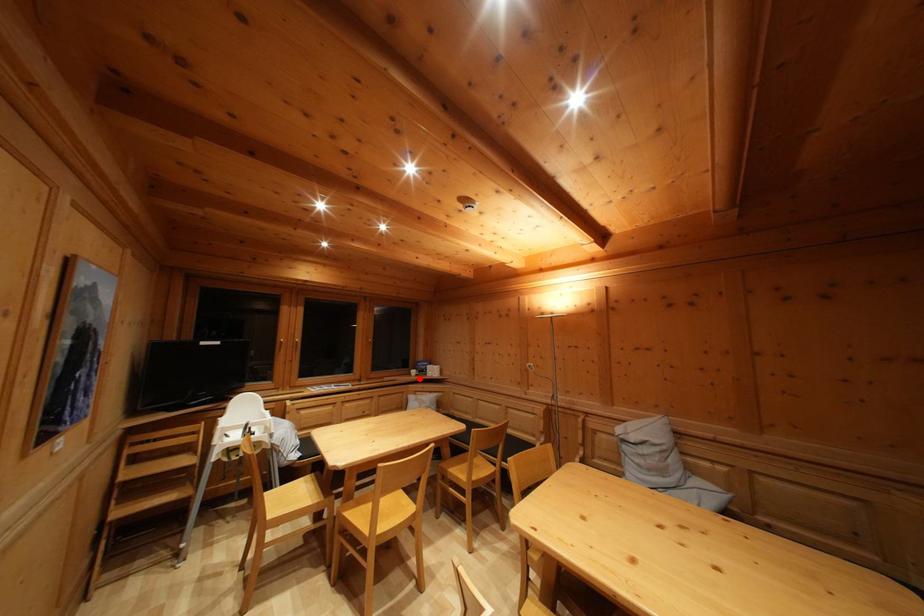
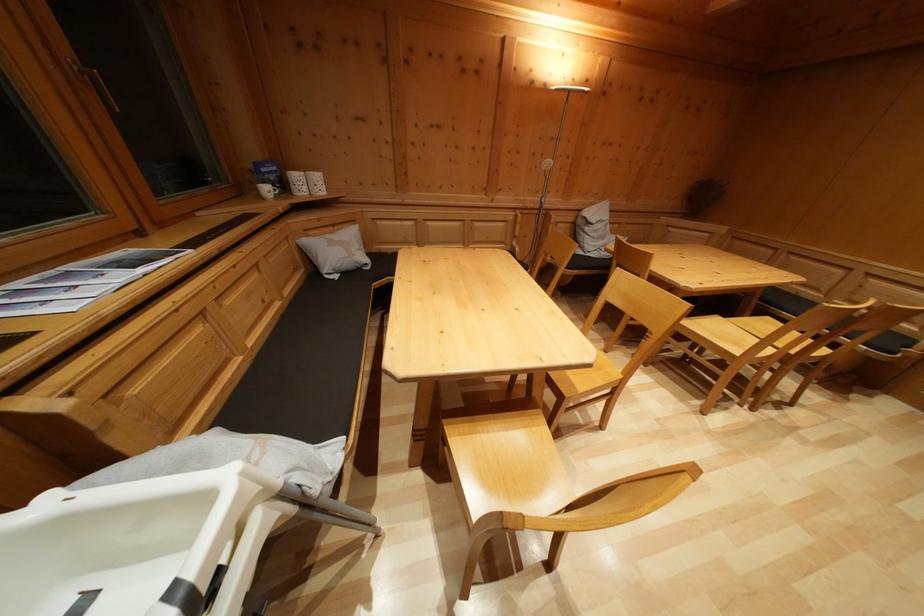
Find the pixel in the second image that matches the highlighted location in the first image.

(273, 197)